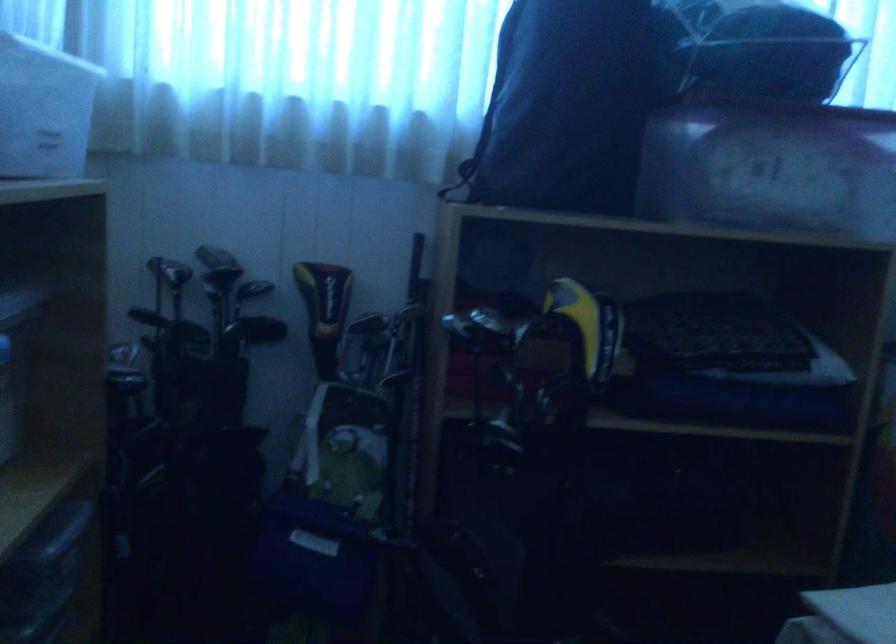
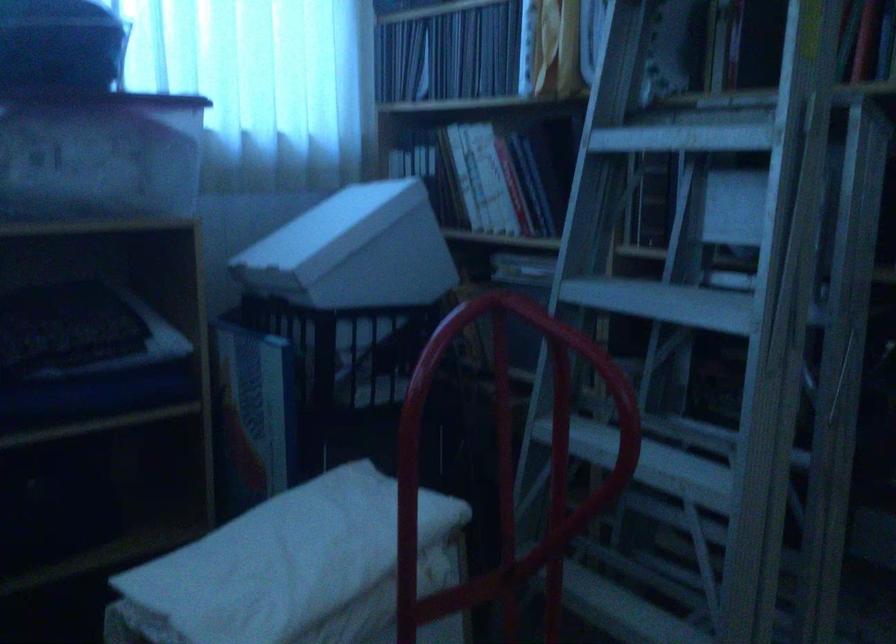
Question: The camera is either moving clockwise (left) or counter-clockwise (right) around the object. The first image is from the beginning of the video and the second image is from the end. Is the camera moving left or right when shooting the video?

Choices:
 (A) Left
 (B) Right

Answer: (A)